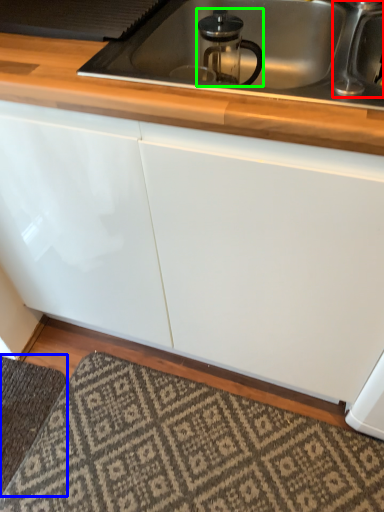
Question: Which object is the closest to the faucet (highlighted by a red box)? Choose among these: doormat (highlighted by a blue box) or appliance (highlighted by a green box).

Choices:
 (A) doormat
 (B) appliance

Answer: (B)